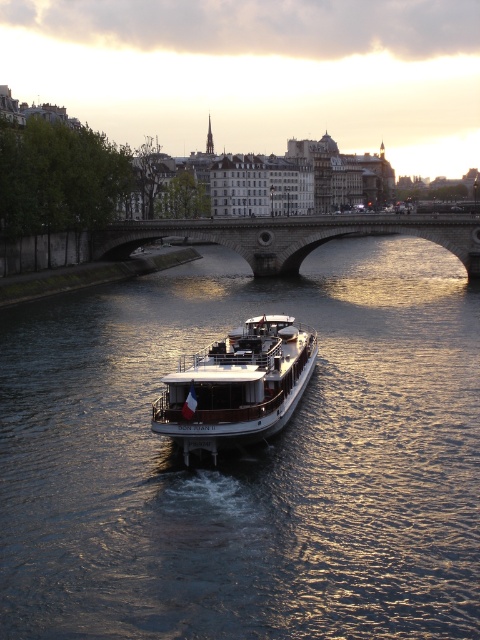
Can you confirm if shiny dark water at center is positioned to the right of white polished wood boat at center?

Correct, you'll find shiny dark water at center to the right of white polished wood boat at center.

The height and width of the screenshot is (640, 480). In order to click on shiny dark water at center in this screenshot , I will do `click(247, 458)`.

The width and height of the screenshot is (480, 640). I want to click on shiny dark water at center, so click(x=247, y=458).

Is shiny dark water at center closer to the viewer compared to stone arch bridge at center?

Yes, it is in front of stone arch bridge at center.

Between point (78, 428) and point (420, 225), which one is positioned in front?

Point (78, 428) is in front.

The height and width of the screenshot is (640, 480). What are the coordinates of `shiny dark water at center` in the screenshot? It's located at (247, 458).

Can you confirm if white polished wood boat at center is smaller than stone arch bridge at center?

Yes.

Which is above, white polished wood boat at center or stone arch bridge at center?

stone arch bridge at center

Identify the location of white polished wood boat at center. The image size is (480, 640). (237, 387).